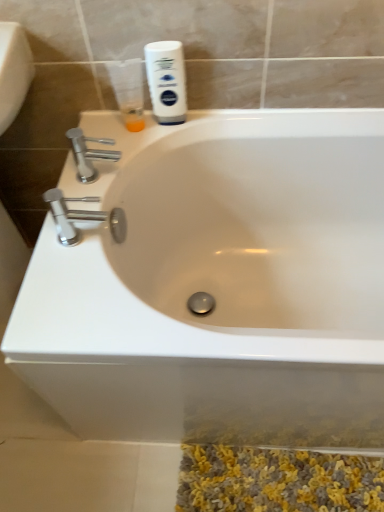
Locate an element on the screen. This screenshot has width=384, height=512. vacant space to the right of white matte shaving cream at upper center is located at coordinates (225, 121).